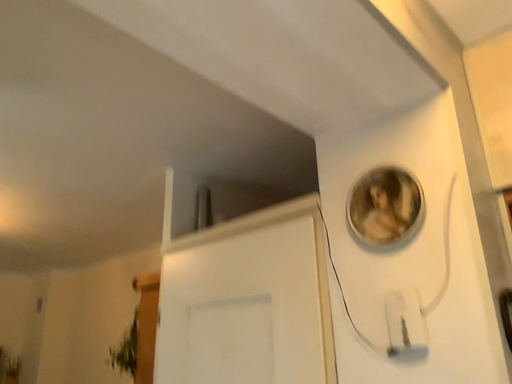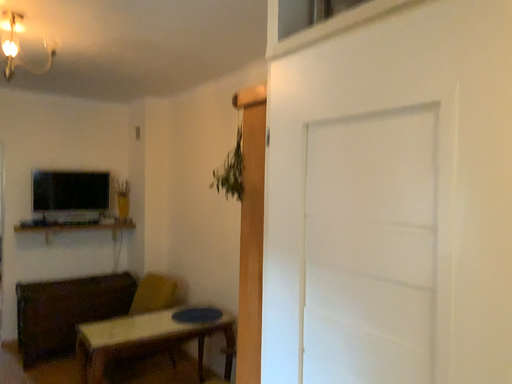
Question: Which way did the camera rotate in the video?

Choices:
 (A) rotated right
 (B) rotated left

Answer: (B)